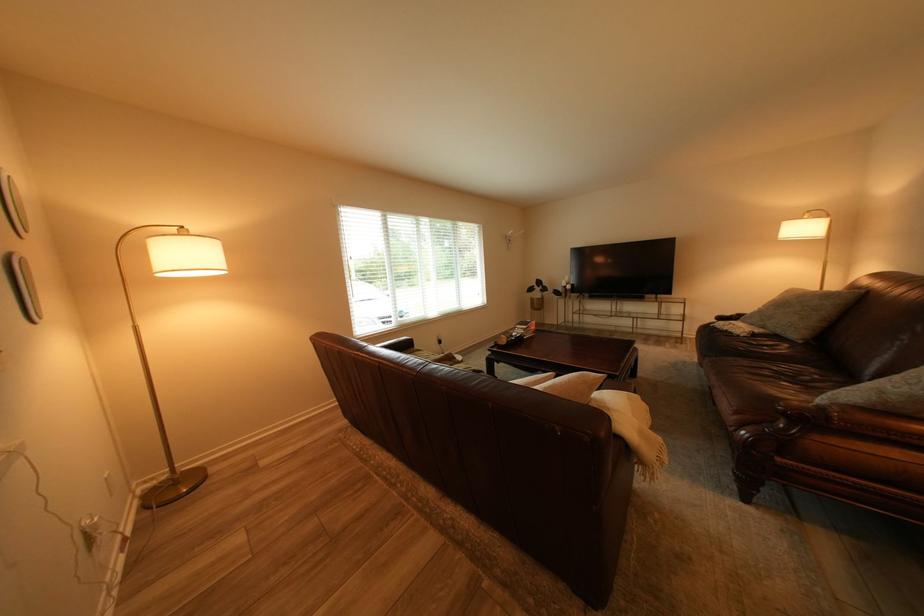
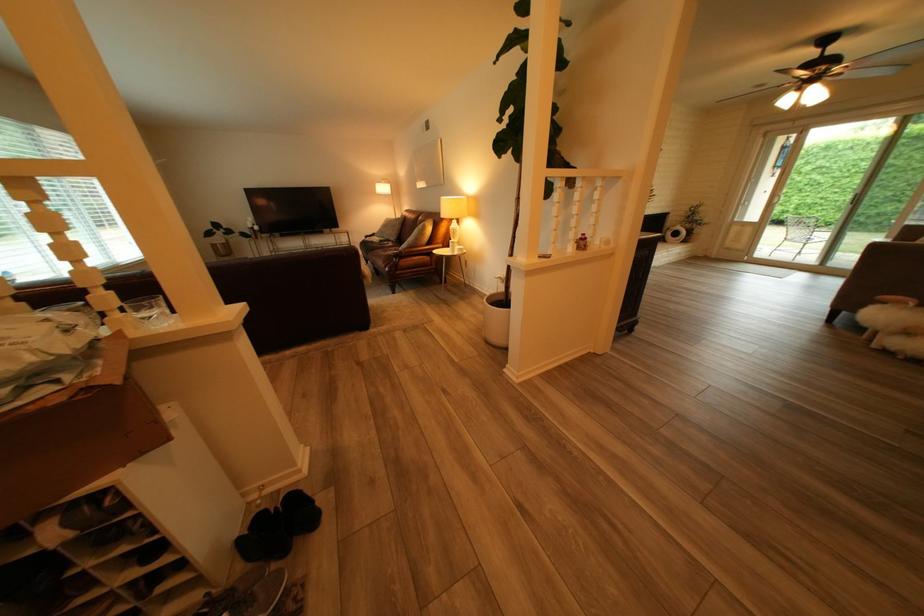
Locate, in the second image, the point that corresponds to [736,326] in the first image.

(383, 240)